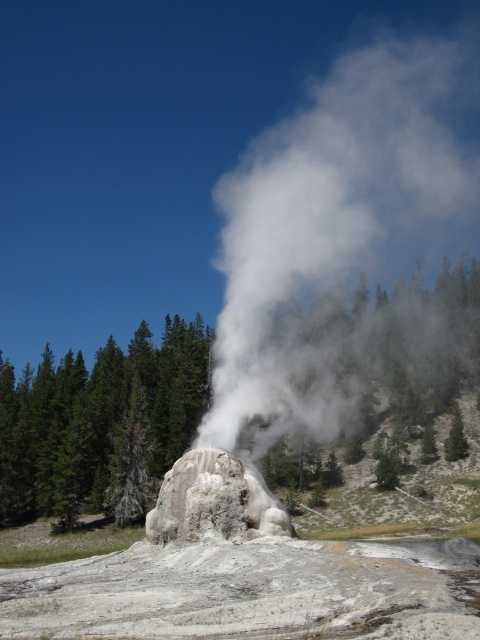
From the picture: You are standing at the point marked as point (99, 426) in the image. Looking around, you see a green textured tree at center. Which direction should you face to see the green textured tree at center?

You are already at the location of the green textured tree at center, so you can see it in any direction.

You are standing at the base of the geyser and want to move towards the point labeled point [282,401] and point [217,525]. Which point will you reach first?

You will reach point [282,401] first because it is closer to you than point [217,525], which is further away.

You are a hiker in the forest and you see the white vapor at center and the green textured tree at center. Which one is higher in the scene?

The white vapor at center is located above the green textured tree at center, so it is higher in the scene.